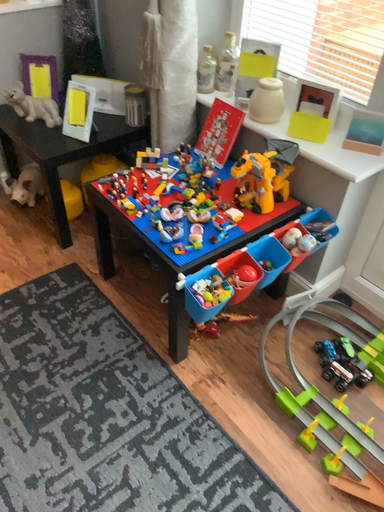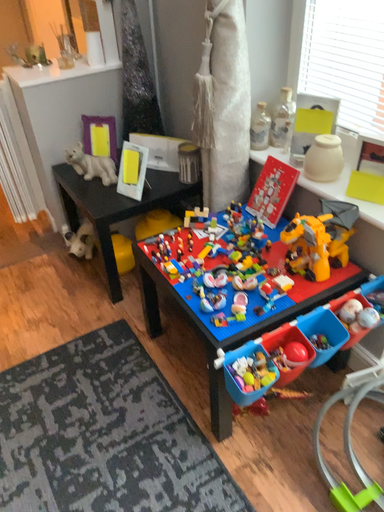
Question: Which way did the camera rotate in the video?

Choices:
 (A) rotated left
 (B) rotated right

Answer: (A)